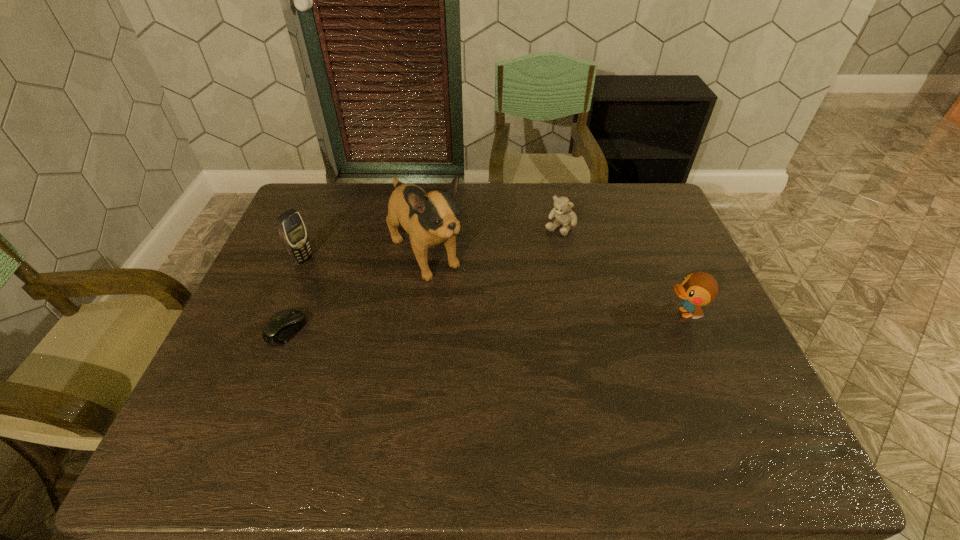
In order to click on vacant space located 0.050m on the face of the second object from right to left in this screenshot , I will do `click(546, 245)`.

This screenshot has height=540, width=960. I want to click on puppy present at the far edge, so (x=430, y=219).

At what (x,y) coordinates should I click in order to perform the action: click on teddy bear at the far edge. Please return your answer as a coordinate pair (x, y). Looking at the image, I should click on (562, 212).

Identify the location of mouse that is at the left edge. The width and height of the screenshot is (960, 540). (281, 327).

Image resolution: width=960 pixels, height=540 pixels. Identify the location of cellular telephone present at the left edge. (291, 228).

Where is `object that is at the right edge`? The width and height of the screenshot is (960, 540). object that is at the right edge is located at coordinates (697, 289).

Identify the location of free space at the far edge of the desktop. (591, 206).

I want to click on vacant space at the near edge, so click(549, 382).

Find the location of a particular element. The height and width of the screenshot is (540, 960). vacant space at the right edge of the desktop is located at coordinates tap(675, 230).

Identify the location of vacant space at the far left corner of the desktop. The image size is (960, 540). (325, 213).